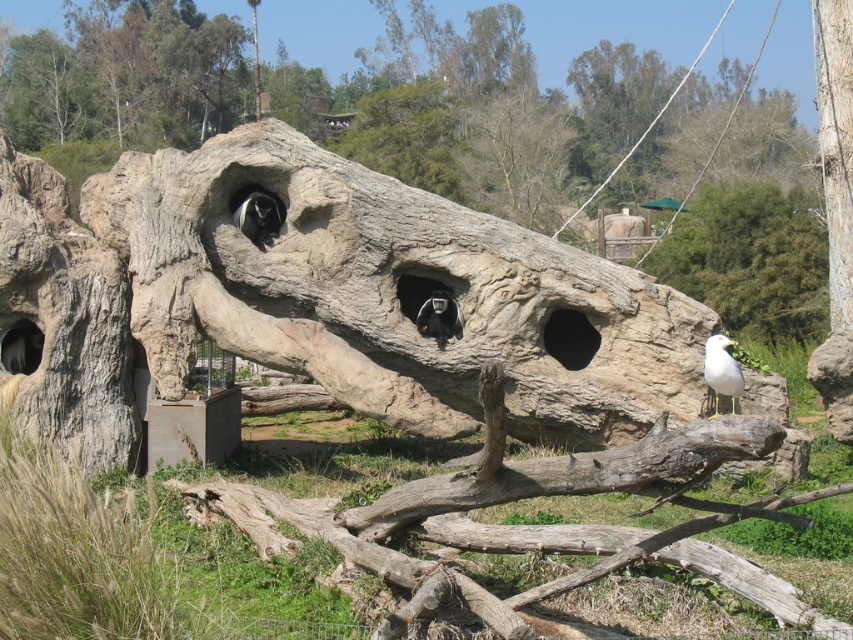
Question: Does black matte hole at center come in front of black fur monkey at center?

Choices:
 (A) yes
 (B) no

Answer: (B)

Question: Which point is farther from the camera taking this photo?

Choices:
 (A) (453, 332)
 (B) (849, 77)
 (C) (582, 365)
 (D) (252, 224)

Answer: (B)

Question: Which point appears closest to the camera in this image?

Choices:
 (A) (231, 216)
 (B) (791, 196)
 (C) (561, 355)
 (D) (425, 276)

Answer: (A)

Question: Can you confirm if rough bark tree trunk at upper right is positioned to the right of black fur monkey at center?

Choices:
 (A) no
 (B) yes

Answer: (B)

Question: Is smooth bark tree trunk at center to the right of black matte hole at center from the viewer's perspective?

Choices:
 (A) yes
 (B) no

Answer: (A)

Question: Which point is closer to the camera?

Choices:
 (A) (544, 336)
 (B) (430, 328)
 (C) (712, 365)

Answer: (C)